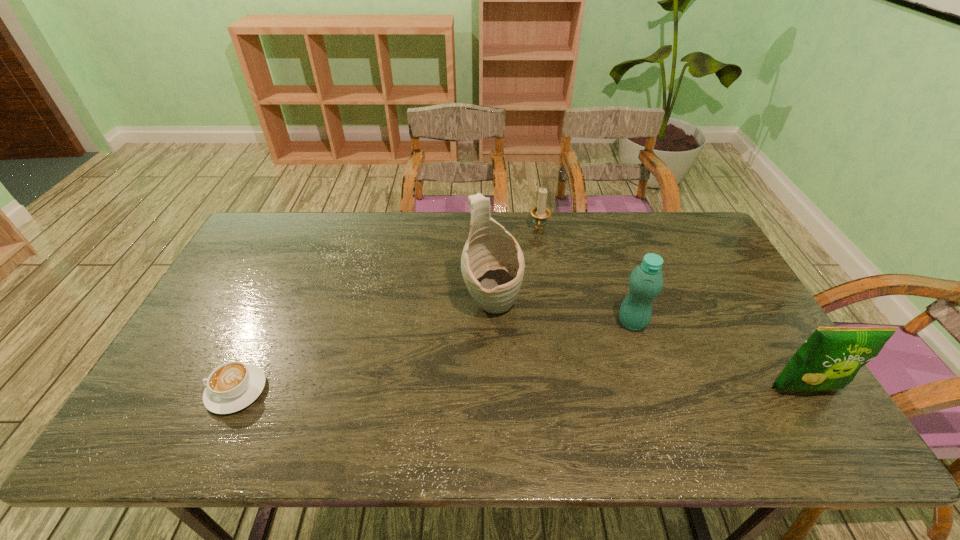
The height and width of the screenshot is (540, 960). In order to click on cappuccino in this screenshot , I will do `click(232, 386)`.

This screenshot has width=960, height=540. In order to click on the leftmost object in this screenshot , I will do `click(232, 386)`.

Where is `crisp (potato chip)`? crisp (potato chip) is located at coordinates (830, 358).

In order to click on the second shortest object in this screenshot , I will do `click(540, 213)`.

Locate an element on the screen. The height and width of the screenshot is (540, 960). the third object from left to right is located at coordinates pos(540,213).

Find the location of a particular element. This screenshot has height=540, width=960. the second object from left to right is located at coordinates (492, 263).

This screenshot has width=960, height=540. In order to click on the tallest object in this screenshot , I will do `click(492, 263)`.

What are the coordinates of `water bottle` in the screenshot? It's located at (646, 280).

Locate an element on the screen. This screenshot has height=540, width=960. free space located 0.090m on the side of the leftmost object with the handle is located at coordinates (171, 391).

I want to click on vacant space positioned 0.130m on the side of the leftmost object with the handle, so click(155, 391).